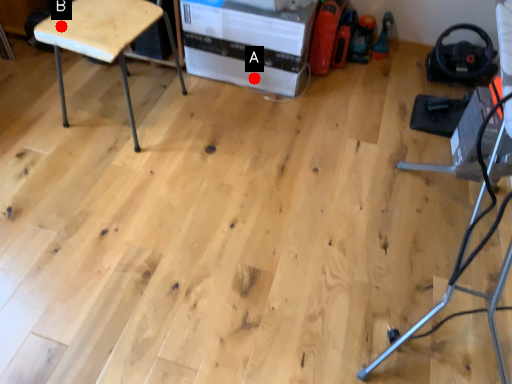
Question: Two points are circled on the image, labeled by A and B beside each circle. Among these points, which one is farthest from the camera?

Choices:
 (A) A is further
 (B) B is further

Answer: (A)